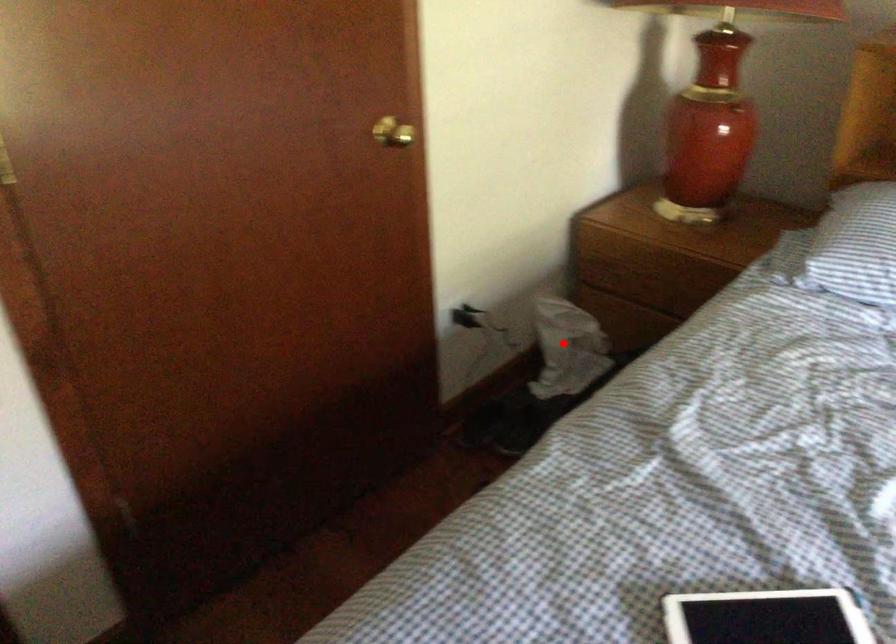
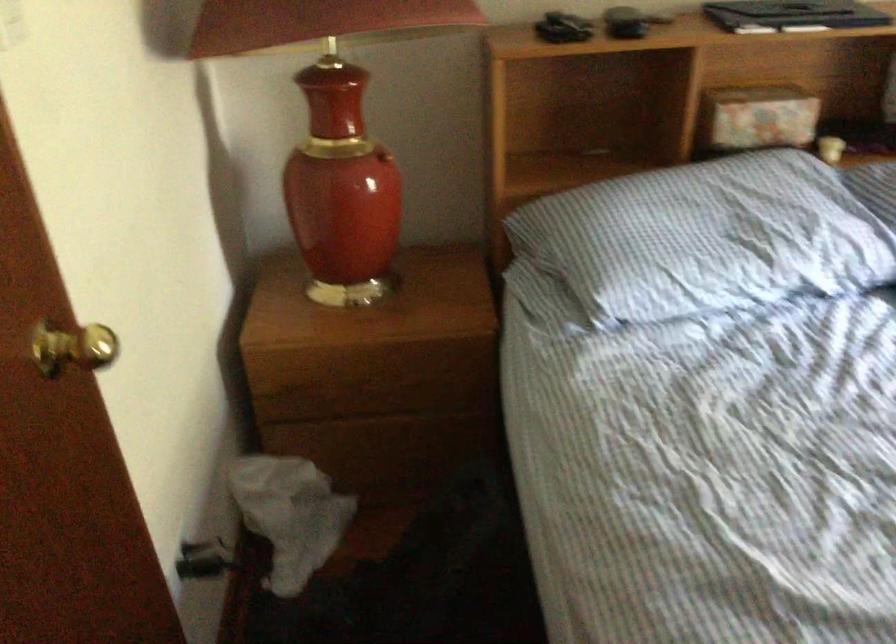
Locate, in the second image, the point that corresponds to the highlighted location in the first image.

(289, 515)